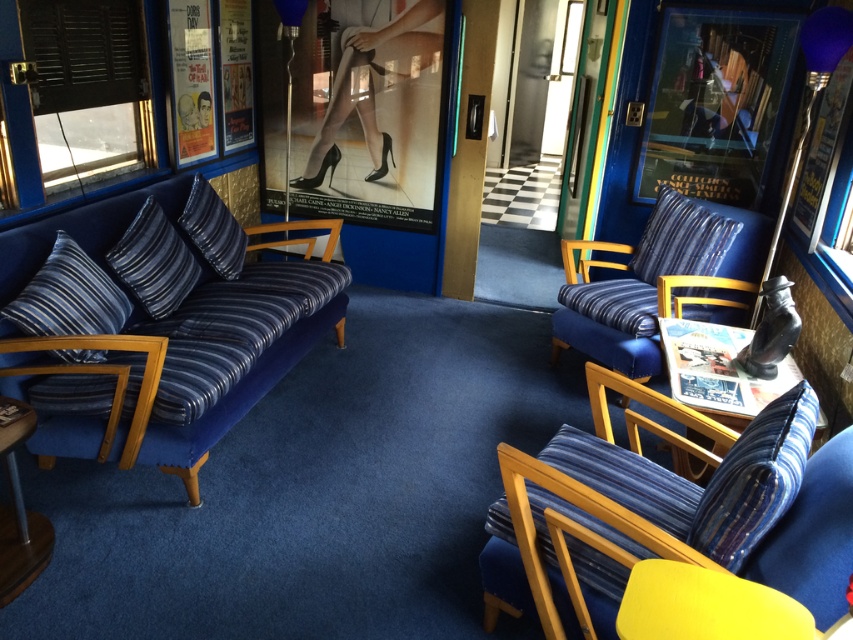
You are sitting in the velvet blue armchair at right and want to reach the blue striped pillow at left. Based on the scene description, can you determine if you can easily reach it without moving from your seat?

The velvet blue armchair at right is below the blue striped pillow at left, so you can easily reach it without moving from your seat.

You are sitting in the retro lounge and want to place a small book on the nearest blue striped pillow. Which one should you choose between the blue striped pillow at left and the blue striped pillow at center?

The blue striped pillow at left is located below the blue striped pillow at center, so it is closer to you. You should place the book on the blue striped pillow at left.